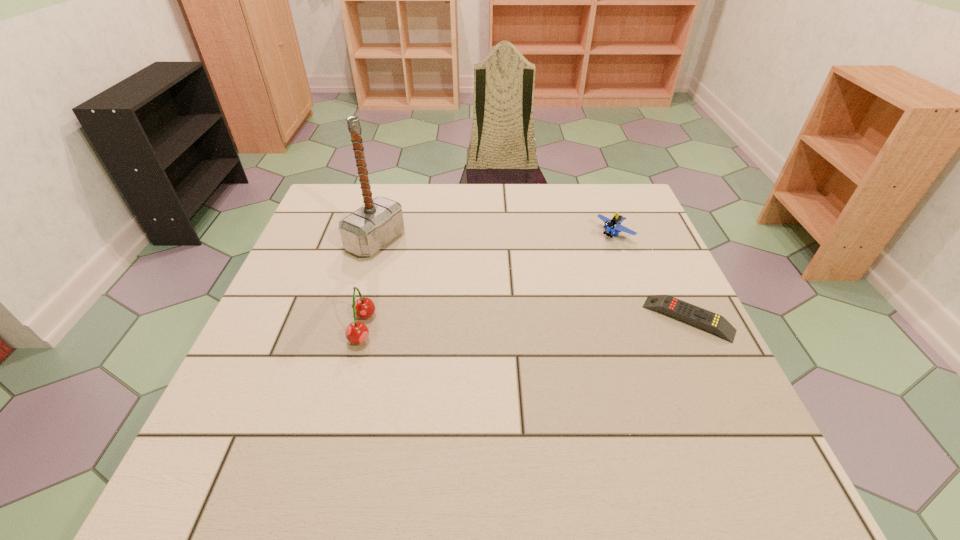
Identify the location of free region at the left edge. The height and width of the screenshot is (540, 960). (284, 283).

I want to click on blank space at the right edge, so click(652, 272).

Identify the location of vacant space at the far right corner of the desktop. This screenshot has height=540, width=960. (649, 221).

I want to click on vacant space at the near right corner of the desktop, so click(673, 430).

Image resolution: width=960 pixels, height=540 pixels. Identify the location of empty space between the hammer and the Lego. (495, 238).

Locate an element on the screen. The width and height of the screenshot is (960, 540). empty space that is in between the third shortest object and the Lego is located at coordinates (488, 281).

The image size is (960, 540). I want to click on vacant region between the tallest object and the shortest object, so click(532, 280).

Where is `unoccupied position between the remote control and the third tallest object`? This screenshot has height=540, width=960. unoccupied position between the remote control and the third tallest object is located at coordinates (651, 276).

Find the location of a particular element. This screenshot has height=540, width=960. empty space that is in between the Lego and the cherry is located at coordinates (488, 281).

Where is `free area in between the cherry and the third tallest object`? free area in between the cherry and the third tallest object is located at coordinates (488, 281).